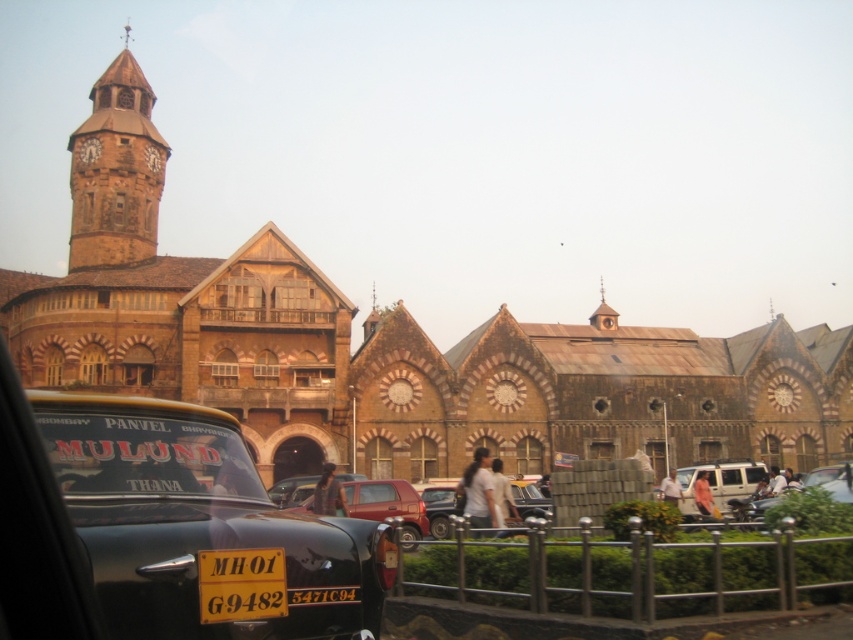
You are a pedestrian standing at the crosswalk in front of the historic building with the clock tower. You see a metallic red suv at center and a metallic silver car at center. Which vehicle is positioned lower in the scene?

The metallic red suv at center is positioned lower than the metallic silver car at center in the scene.

You are a photographer standing at the base of the historic building. You want to capture a photo that includes both the brown stone clock tower at upper left and the vintage black car with a yellow license plate reading MH 01 G9482 in the foreground. Given that the clock tower is 94.75 meters away from your position, can you estimate whether the car will be in focus if you set your camera to focus on the clock tower?

The brown stone clock tower at upper left is 94.75 meters away from the camera. Since the vintage black car with a yellow license plate reading MH 01 G9482 is in the foreground, it is closer to the camera than the clock tower. If the camera is focused on the clock tower, the car may not be in focus because it is outside the depth of field range unless a very narrow aperture is used.

You are a pedestrian standing on the sidewalk in front of the historic building. You want to look at the clock face on the brown stone clock tower at upper left but there is a transparent glass car window at center in your way. Can you still see the clock tower through the car window?

The transparent glass car window at center is behind the brown stone clock tower at upper left, so the clock tower is in front of the car window. Therefore, you can see the clock tower directly without obstruction from the car window.